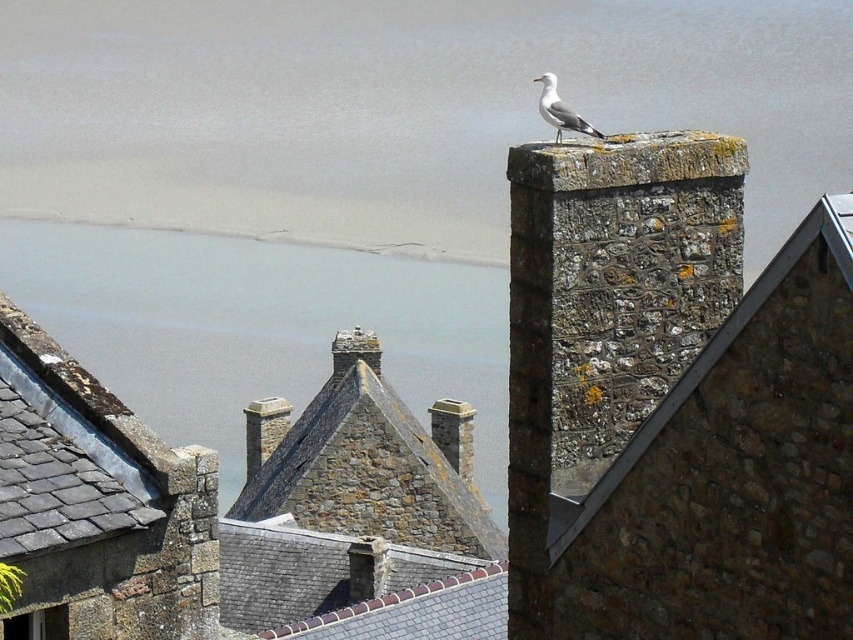
You are standing in front of the coastal stone buildings and see the gray stone water at upper center and the white feathered bird at upper center. Which object is closer to you?

The gray stone water at upper center is closer to you because it is further to the viewer than the white feathered bird at upper center.